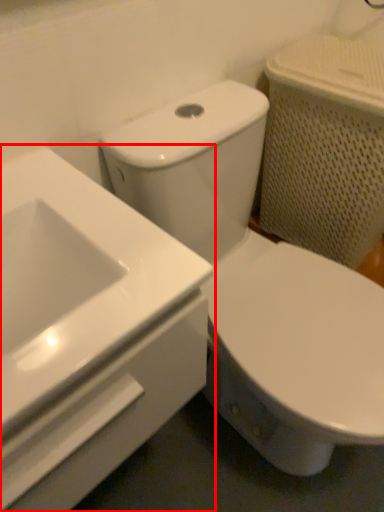
Question: From the image's perspective, what is the correct spatial relationship of sink (annotated by the red box) in relation to toilet?

Choices:
 (A) above
 (B) below

Answer: (A)